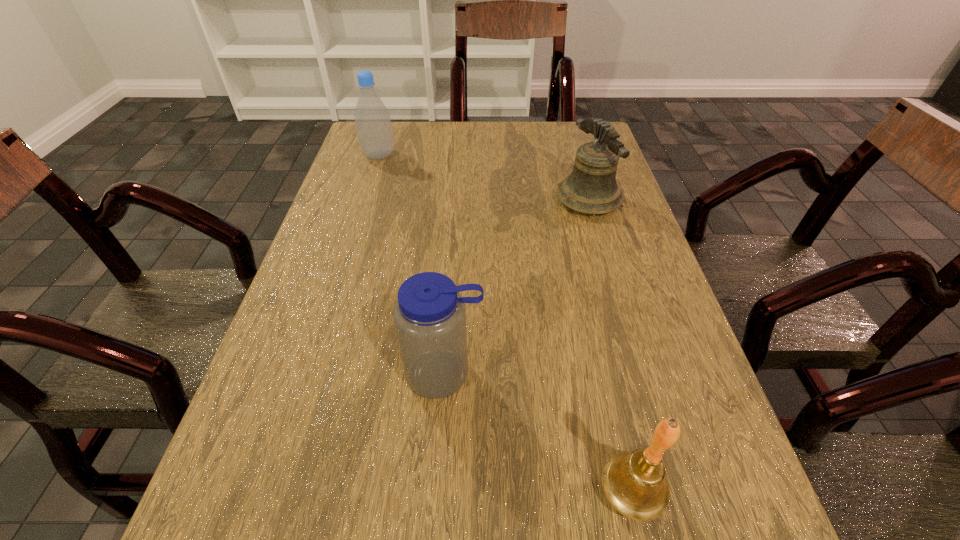
The width and height of the screenshot is (960, 540). Identify the location of object at the far edge. 372,119.

The height and width of the screenshot is (540, 960). Identify the location of object that is at the left edge. (372, 119).

Find the location of a particular element. This screenshot has width=960, height=540. object that is at the far left corner is located at coordinates (372, 119).

The height and width of the screenshot is (540, 960). In order to click on vacant area at the far edge of the desktop in this screenshot , I will do `click(505, 132)`.

Locate an element on the screen. The height and width of the screenshot is (540, 960). vacant area at the left edge of the desktop is located at coordinates (315, 256).

Locate an element on the screen. This screenshot has width=960, height=540. free space at the right edge of the desktop is located at coordinates (676, 512).

Locate an element on the screen. This screenshot has height=540, width=960. blank space at the far right corner is located at coordinates (570, 121).

I want to click on free space between the third object from right to left and the bottle, so click(x=412, y=265).

I want to click on free space between the farther bell and the third farthest object, so click(516, 287).

Locate an element on the screen. This screenshot has height=540, width=960. vacant region between the second farthest object and the nearest object is located at coordinates (610, 346).